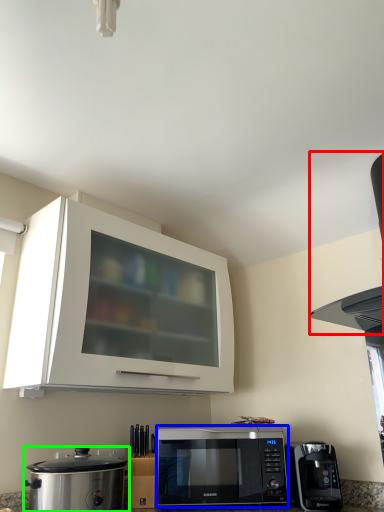
Question: Considering the real-world distances, which object is closest to vent (highlighted by a red box)? microwave oven (highlighted by a blue box) or home appliance (highlighted by a green box).

Choices:
 (A) microwave oven
 (B) home appliance

Answer: (A)